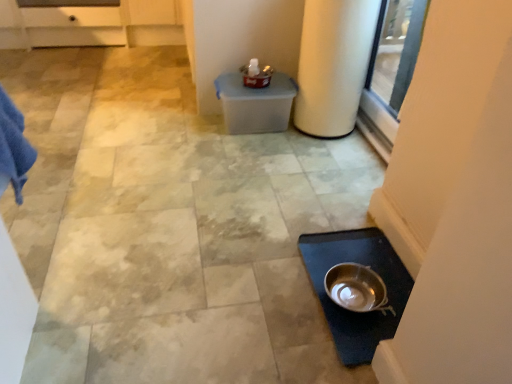
Question: Considering the positions of point (340, 263) and point (324, 64), is point (340, 263) closer or farther from the camera than point (324, 64)?

Choices:
 (A) closer
 (B) farther

Answer: (A)

Question: From the image's perspective, relative to white matte cylindrical at right, is silver metallic mixing bowl at lower right above or below?

Choices:
 (A) below
 (B) above

Answer: (A)

Question: From a real-world perspective, is silver metallic mixing bowl at lower right above or below white matte cylindrical at right?

Choices:
 (A) below
 (B) above

Answer: (A)

Question: Looking at their shapes, would you say white matte cylindrical at right is wider or thinner than silver metallic mixing bowl at lower right?

Choices:
 (A) thin
 (B) wide

Answer: (B)

Question: From their relative heights in the image, would you say white matte cylindrical at right is taller or shorter than silver metallic mixing bowl at lower right?

Choices:
 (A) tall
 (B) short

Answer: (A)

Question: In the image, is white matte cylindrical at right positioned in front of or behind silver metallic mixing bowl at lower right?

Choices:
 (A) front
 (B) behind

Answer: (B)

Question: From the image's perspective, is white matte cylindrical at right above or below silver metallic mixing bowl at lower right?

Choices:
 (A) below
 (B) above

Answer: (B)